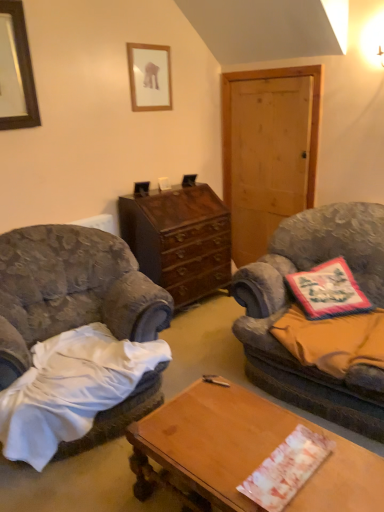
Locate an element on the screen. The height and width of the screenshot is (512, 384). empty space that is ontop of wooden desk at center is located at coordinates (259, 444).